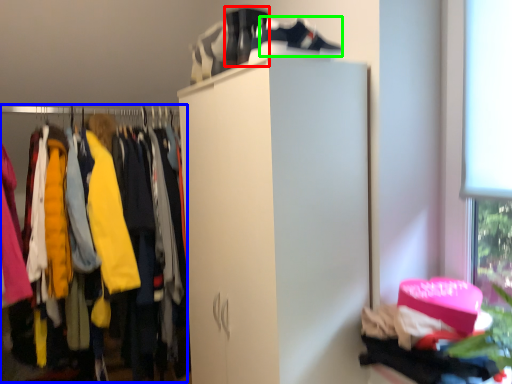
Question: Based on their relative distances, which object is farther from running shoe (highlighted by a red box)? Choose from closet (highlighted by a blue box) and shoe (highlighted by a green box).

Choices:
 (A) closet
 (B) shoe

Answer: (A)